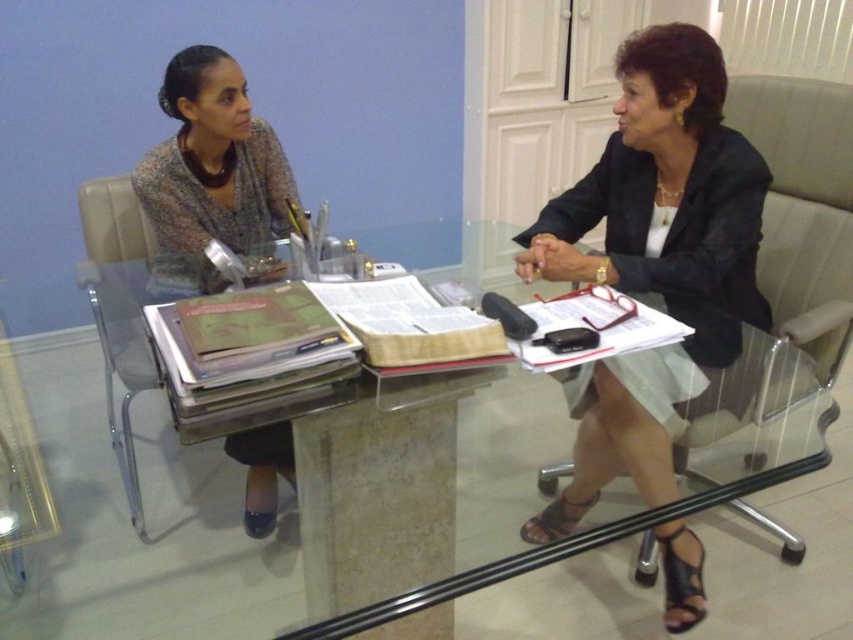
You are organizing a meeting in an office. You see the matte black jacket at center and the black matte business suit at right. Which object should you move to make space for a large binder? Explain your choice based on their sizes.

The matte black jacket at center is larger in size than the black matte business suit at right. Therefore, moving the matte black jacket at center would create more space for the large binder since it occupies a bigger area on the table.

Based on the photo, you are standing in an office and see a point marked at coordinates (248,214). If you want to place a 6 foot ruler on the table so it extends from the point to the edge of the table, will it fit?

The distance from the point to the camera is 6.36 feet, so the ruler will fit as it is slightly longer than the distance.

You are an office assistant who needs to place a new document on the transparent glass table at center. However, there is already a matte black jacket at center on the table. Is there enough space to place the document without moving the jacket?

The matte black jacket at center is larger in size than transparent glass table at center, so there might not be enough space to place the document without moving the jacket.